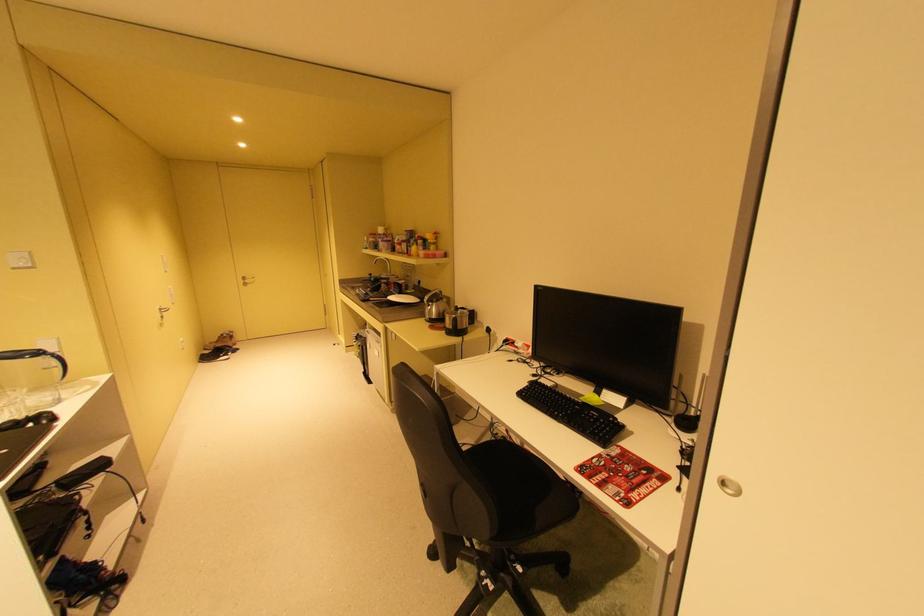
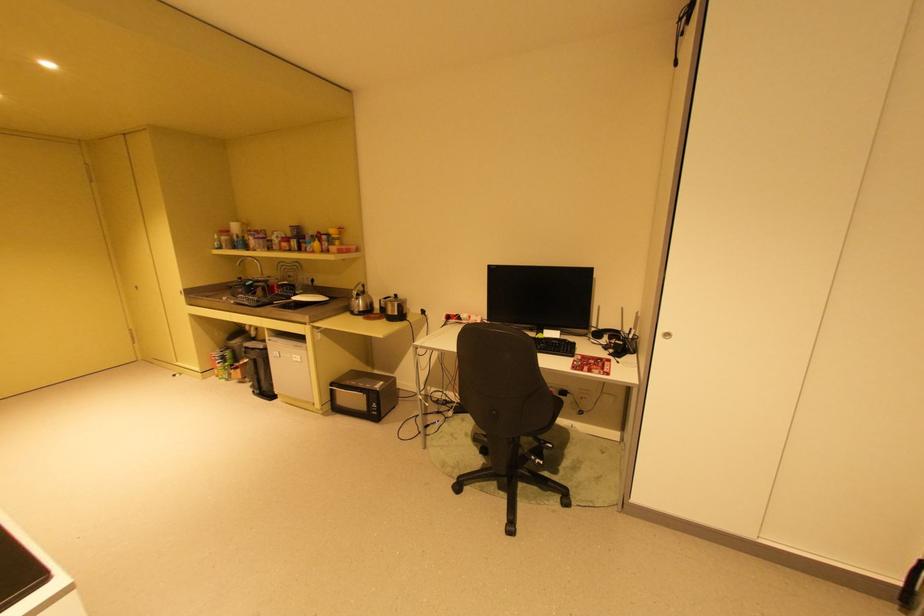
Where in the second image is the point corresponding to point 433,376 from the first image?

(359, 371)